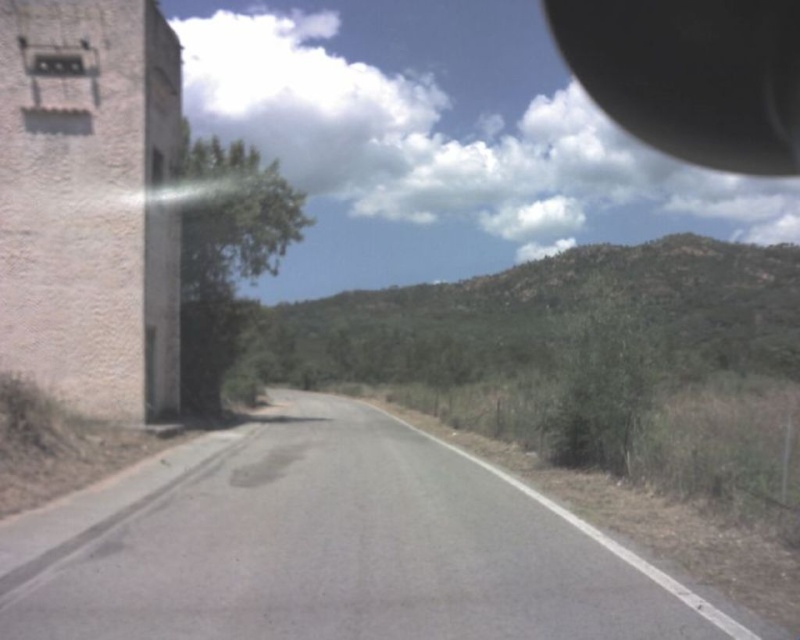
You are standing at the starting point of the road and want to reach the end of the gray asphalt road at center. According to the coordinates provided, in which direction should you walk to stay on the road?

The gray asphalt road at center is located at point (330, 547), so you should walk towards the coordinates to stay on the road. Since the road curves gently to the right, you should adjust your direction slightly to the right as you move forward to follow the road.

You are a drone operator trying to capture aerial shots of the road scene. You have two points marked on your map, point 1 at coordinates point (548, 604) and point 2 at coordinates point (780, 136). Which point should you prioritize photographing first if you want to capture details closer to the camera?

Point (548, 604) is closer to the camera than point (780, 136), so you should prioritize photographing point (548, 604) first to capture details closer to the camera.

You are driving a car and see the gray asphalt road at center and the black rubber view mirror at upper right. Which object is closer to you?

The gray asphalt road at center is closer to you because it is in front of the black rubber view mirror at upper right.